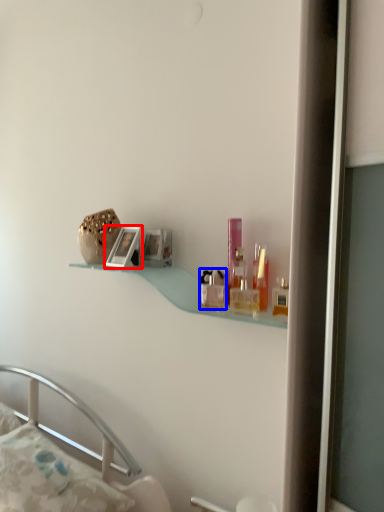
Question: Which of the following is the closest to the observer, picture frame (highlighted by a red box) or toiletry (highlighted by a blue box)?

Choices:
 (A) picture frame
 (B) toiletry

Answer: (B)